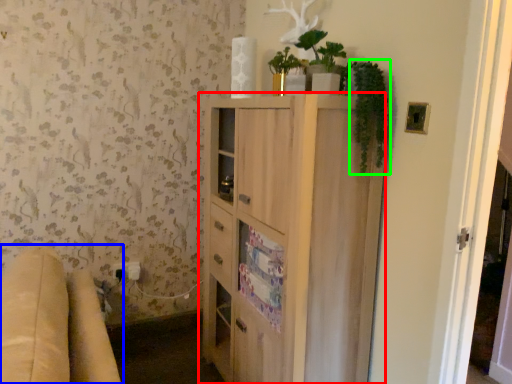
Question: Which object is positioned closest to cabinetry (highlighted by a red box)? Select from studio couch (highlighted by a blue box) and plant (highlighted by a green box).

Choices:
 (A) studio couch
 (B) plant

Answer: (B)